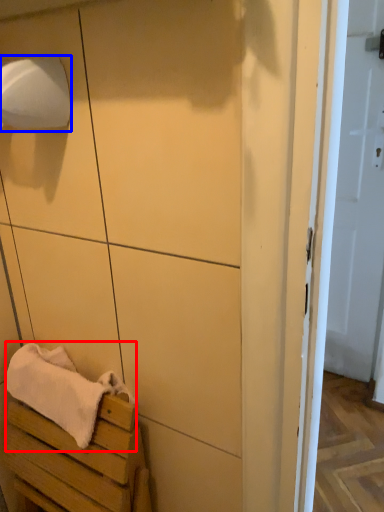
Question: Among these objects, which one is farthest to the camera, bath towel (highlighted by a red box) or toilet paper (highlighted by a blue box)?

Choices:
 (A) bath towel
 (B) toilet paper

Answer: (A)